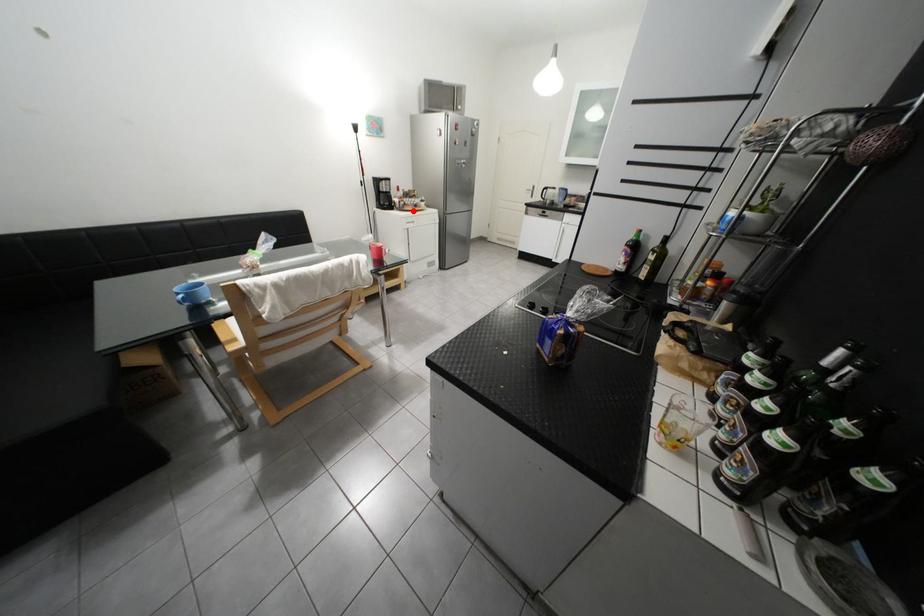
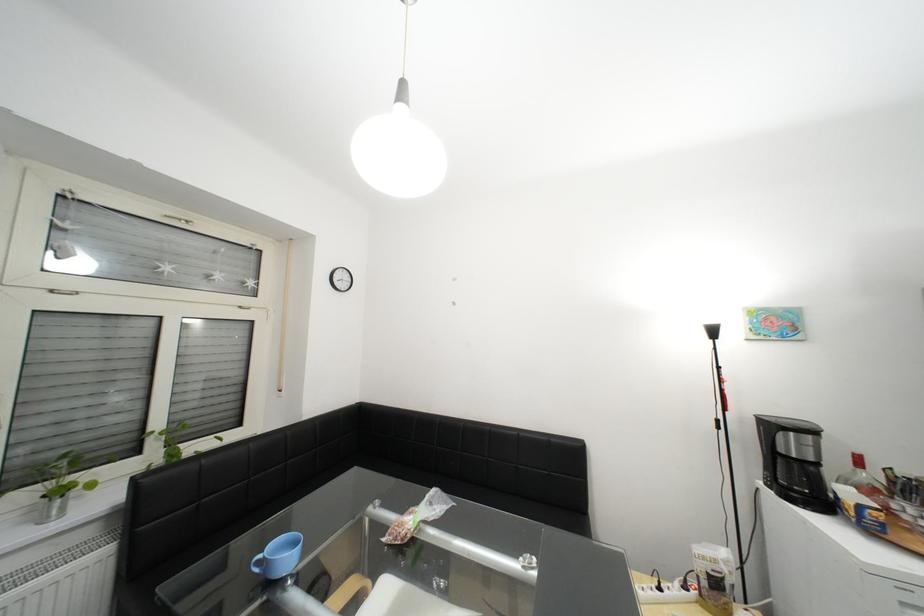
Question: I am providing you with two images of the same scene from different viewpoints. In image1, a red point is highlighted. Considering the same 3D point in image2, which of the following is correct?

Choices:
 (A) It is closer
 (B) It is farther

Answer: (B)